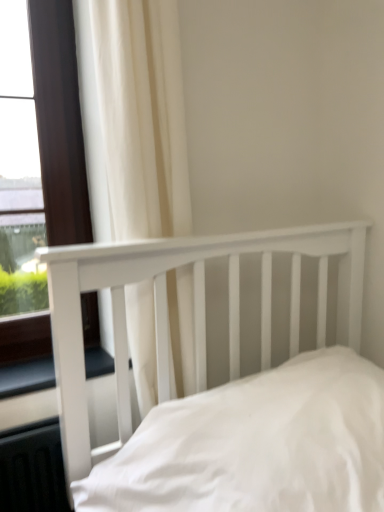
Question: From a real-world perspective, is black rubber window sill at lower left physically located above or below matte brown window at left?

Choices:
 (A) above
 (B) below

Answer: (B)

Question: Is black rubber window sill at lower left bigger or smaller than matte brown window at left?

Choices:
 (A) small
 (B) big

Answer: (A)

Question: Considering the real-world distances, which object is farthest from the white wooden bed at center?

Choices:
 (A) matte brown window at left
 (B) black rubber window sill at lower left
 (C) white fabric curtain at upper left

Answer: (A)

Question: Estimate the real-world distances between objects in this image. Which object is closer to the white wooden bed at center?

Choices:
 (A) black rubber window sill at lower left
 (B) white fabric curtain at upper left
 (C) matte brown window at left

Answer: (B)